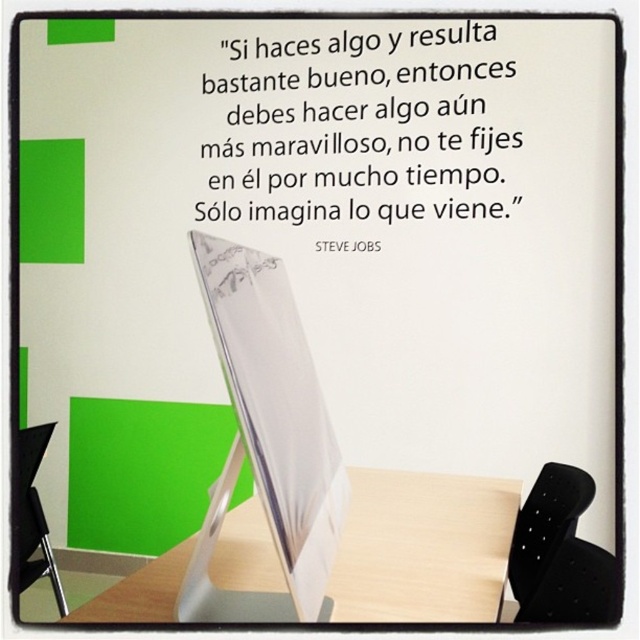
Question: Which object appears farthest from the camera in this image?

Choices:
 (A) wooden table at center
 (B) silver metallic computer screen at center

Answer: (A)

Question: Is silver metallic computer screen at center smaller than wooden table at center?

Choices:
 (A) no
 (B) yes

Answer: (A)

Question: Can you confirm if silver metallic computer screen at center is smaller than wooden table at center?

Choices:
 (A) no
 (B) yes

Answer: (A)

Question: Which of the following is the closest to the observer?

Choices:
 (A) (419, 593)
 (B) (273, 346)

Answer: (B)

Question: Is silver metallic computer screen at center to the left of wooden table at center from the viewer's perspective?

Choices:
 (A) yes
 (B) no

Answer: (A)